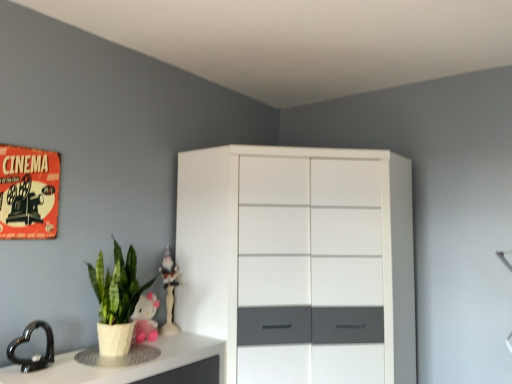
Question: Considering the positions of black glossy heart at lower left and white glossy figurine at upper center, which is counted as the 2th toy, starting from the front, in the image, is black glossy heart at lower left wider or thinner than white glossy figurine at upper center, which is counted as the 2th toy, starting from the front,?

Choices:
 (A) wide
 (B) thin

Answer: (B)

Question: Is black glossy heart at lower left to the left or to the right of white glossy figurine at upper center, the 1th toy positioned from the back, in the image?

Choices:
 (A) right
 (B) left

Answer: (B)

Question: Which object is the closest to the white glossy figurine at upper center, which is counted as the 2th toy, starting from the front?

Choices:
 (A) white glossy counter top at lower left
 (B) black glossy heart at lower left
 (C) pink plush toy at lower left, marked as the 1th toy in a front-to-back arrangement
 (D) white glossy cabinet at center
 (E) green matte plant at lower left

Answer: (C)

Question: Estimate the real-world distances between objects in this image. Which object is farther from the white glossy counter top at lower left?

Choices:
 (A) green matte plant at lower left
 (B) pink plush toy at lower left, the 2th toy viewed from the back
 (C) black glossy heart at lower left
 (D) white glossy figurine at upper center, the 1th toy positioned from the back
 (E) white glossy cabinet at center

Answer: (E)